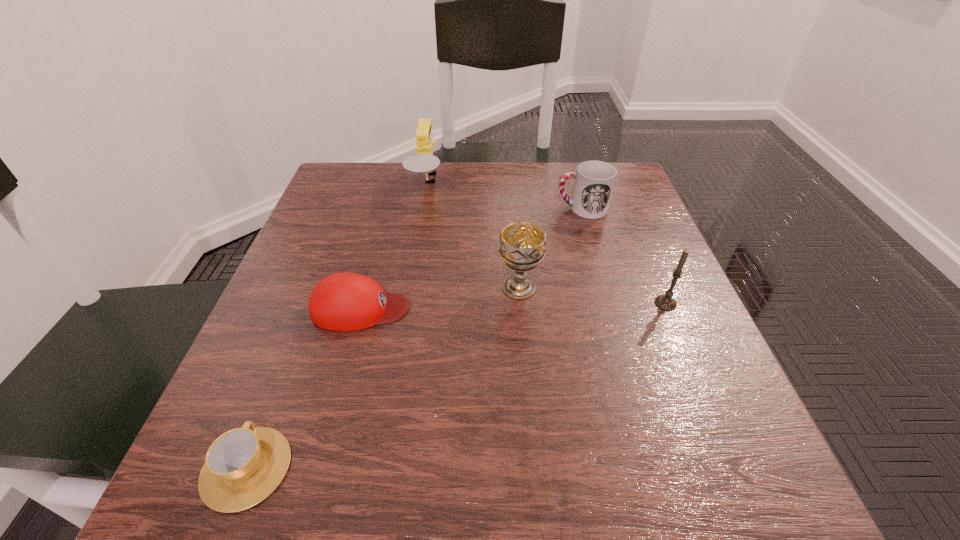
Locate an element on the screen. blank space located 0.270m on the back of the chalice is located at coordinates (511, 197).

Locate an element on the screen. Image resolution: width=960 pixels, height=540 pixels. vacant region located 0.140m on the handle side of the farther cup is located at coordinates (495, 208).

Identify the location of free space located on the handle side of the farther cup. Image resolution: width=960 pixels, height=540 pixels. (400, 208).

Where is `vacant area located 0.260m on the handle side of the farther cup`? The image size is (960, 540). vacant area located 0.260m on the handle side of the farther cup is located at coordinates (444, 208).

You are a GUI agent. You are given a task and a screenshot of the screen. Output one action in this format:
    pyautogui.click(x=<x>, y=<y>)
    Task: Click on the free space located on the front-facing side of the baseball cap
    This screenshot has width=960, height=540.
    Given the screenshot: What is the action you would take?
    pyautogui.click(x=482, y=308)

Image resolution: width=960 pixels, height=540 pixels. What are the coordinates of `free space located with the handle on the side of the left cup` in the screenshot? It's located at (299, 335).

Where is `free space located 0.360m with the handle on the side of the left cup`? free space located 0.360m with the handle on the side of the left cup is located at coordinates (326, 261).

Identify the location of vacant point located with the handle on the side of the left cup. (324, 268).

Locate an element on the screen. The image size is (960, 540). sponge located in the far edge section of the desktop is located at coordinates (424, 161).

Locate an element on the screen. Image resolution: width=960 pixels, height=540 pixels. cup that is at the far edge is located at coordinates (594, 180).